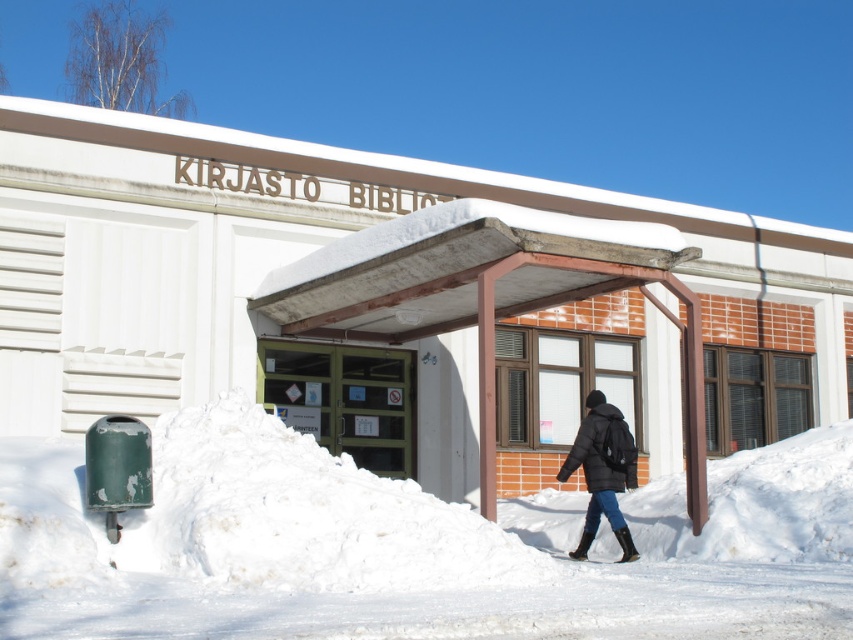
Based on the scene, where is the wooden awning at center located in terms of coordinates?

The wooden awning at center is located at point coordinates (x=488, y=294).

You are standing at the entrance of the library and want to step onto the white fluffy snow at lower center. Based on the coordinates provided, can you determine the direction you need to move relative to the entrance?

The white fluffy snow at lower center is located at coordinates (x=412, y=547). Since the entrance is at the lower part of the image, moving towards the right and slightly forward would lead you to the white fluffy snow at lower center.